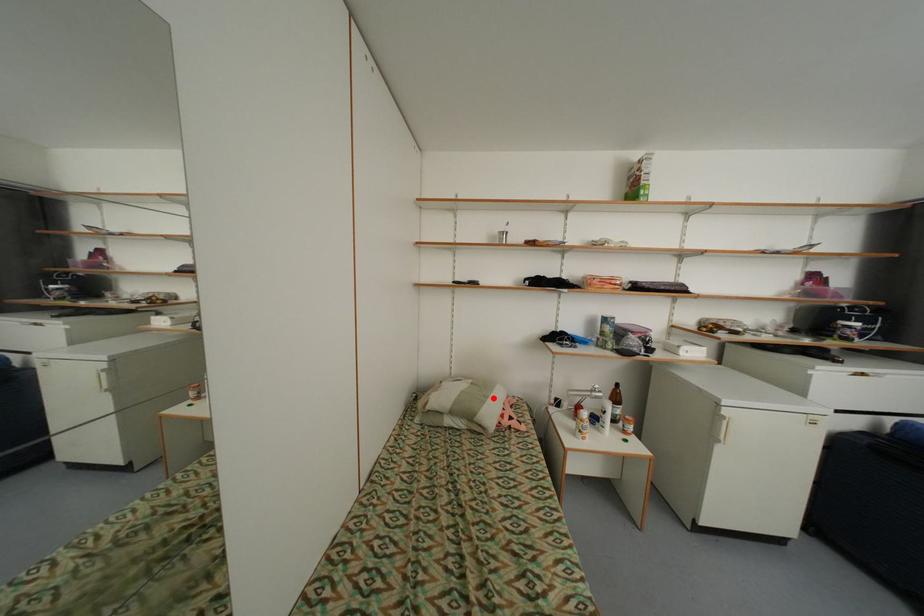
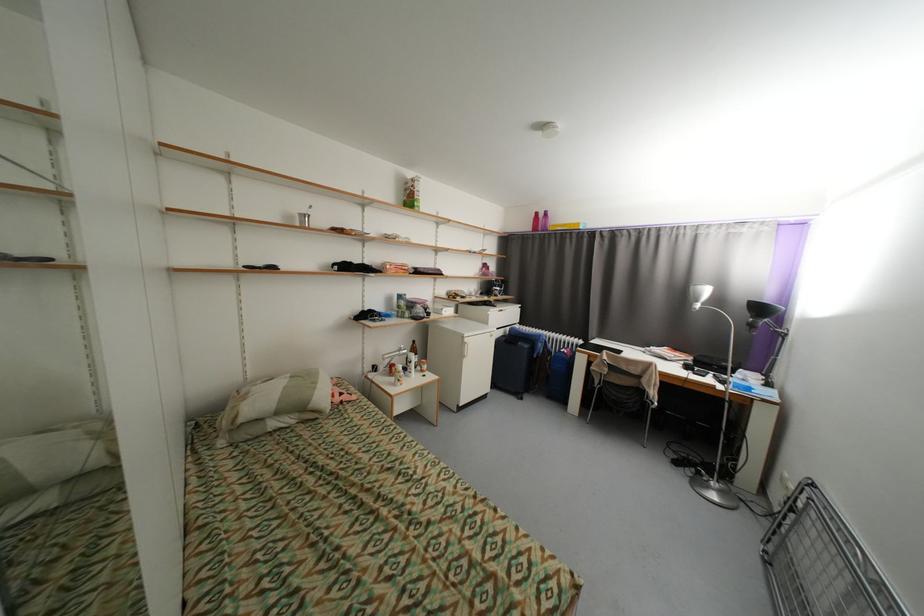
Question: A red point is marked in image1. In image2, is the corresponding 3D point closer to the camera or farther? Reply with the corresponding letter.

Choices:
 (A) The corresponding 3D point is closer.
 (B) The corresponding 3D point is farther.

Answer: (A)